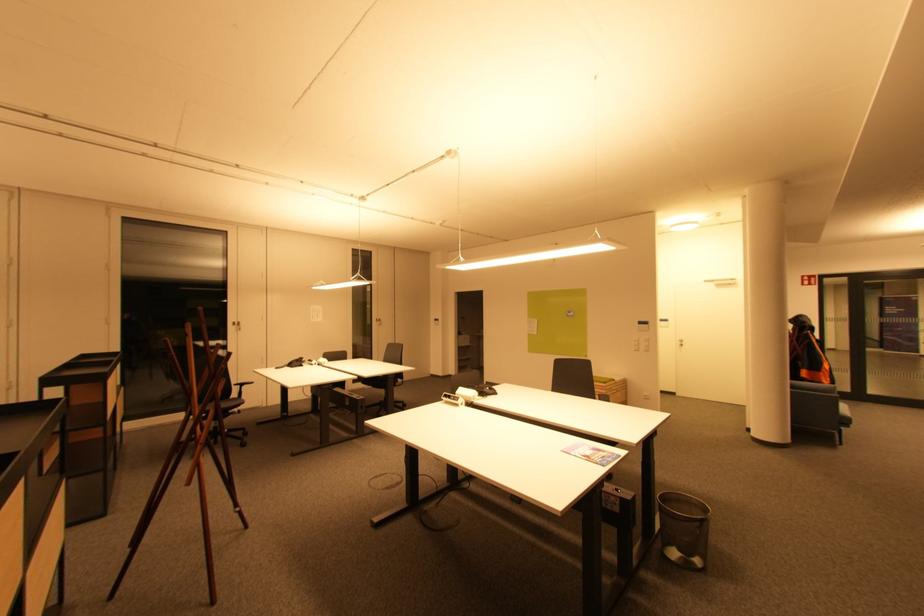
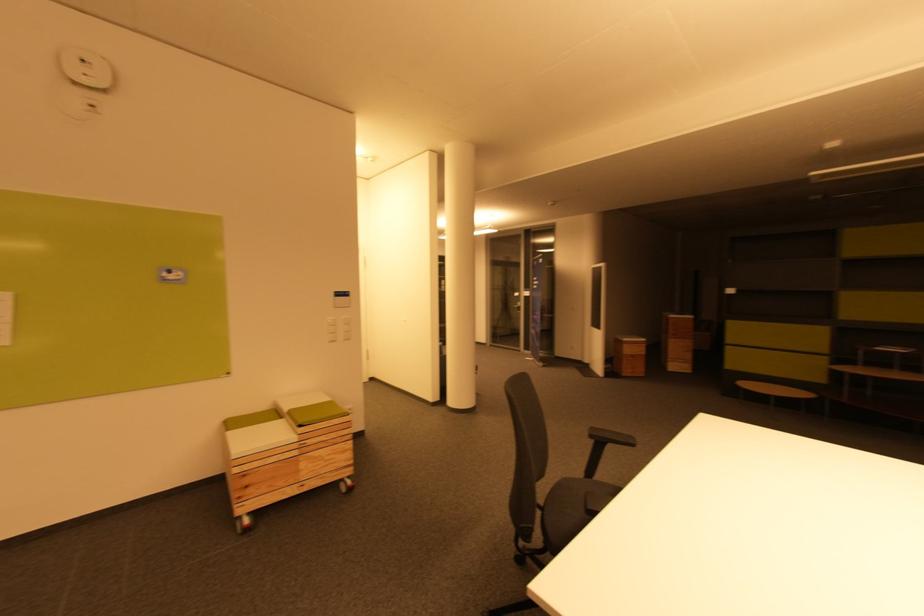
In the second image, find the point that corresponds to the point at 642,323 in the first image.

(342, 294)